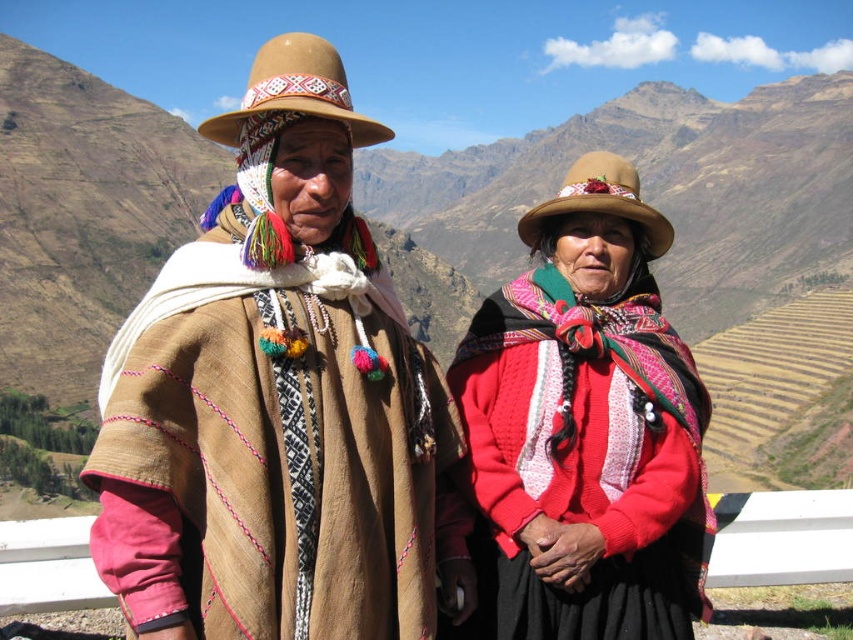
Which of these two, brown woolen poncho at left or knitted wool shawl at center, stands shorter?

Standing shorter between the two is brown woolen poncho at left.

Between point (131, 449) and point (466, 444), which one is positioned in front?

Point (131, 449)

Where is `brown woolen poncho at left`? The height and width of the screenshot is (640, 853). brown woolen poncho at left is located at coordinates (277, 449).

This screenshot has width=853, height=640. I want to click on brown woven hat at center, so click(x=399, y=412).

Where is `brown woven hat at center`? This screenshot has height=640, width=853. brown woven hat at center is located at coordinates (399, 412).

In the scene shown: Between brown woven hat at center and knitted wool shawl at center, which one is positioned higher?

Positioned higher is knitted wool shawl at center.

Is brown woven hat at center wider than knitted wool shawl at center?

Yes.

From the picture: Who is more forward, (297, 195) or (625, 372)?

Point (297, 195) is more forward.

Image resolution: width=853 pixels, height=640 pixels. In order to click on brown woven hat at center in this screenshot , I will do `click(399, 412)`.